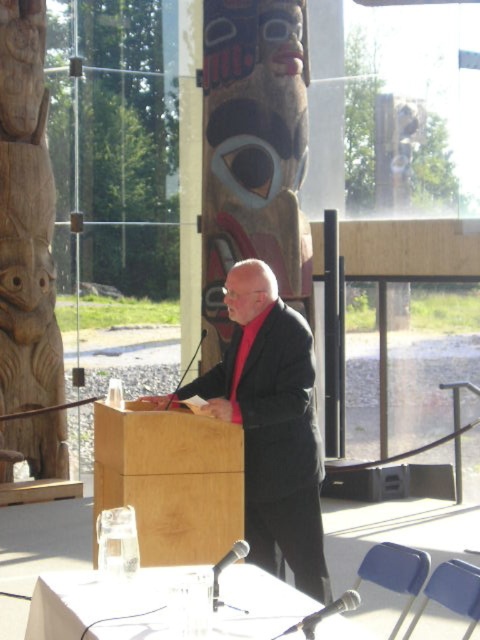
Can you confirm if dark gray suit at center is thinner than light wood podium at center?

Incorrect, dark gray suit at center's width is not less than light wood podium at center's.

Between dark gray suit at center and light wood podium at center, which one appears on the right side from the viewer's perspective?

From the viewer's perspective, dark gray suit at center appears more on the right side.

Does point (263, 385) come in front of point (224, 516)?

No.

Locate an element on the screen. This screenshot has width=480, height=640. dark gray suit at center is located at coordinates (271, 424).

Which of these two, wooden totem pole at left or light wood podium at center, stands taller?

wooden totem pole at left

Is wooden totem pole at left below light wood podium at center?

No.

Find the location of a particular element. The image size is (480, 640). wooden totem pole at left is located at coordinates (25, 216).

I want to click on wooden totem pole at left, so click(x=25, y=216).

Measure the distance between point [299,497] and camera.

Point [299,497] is 16.07 feet away from camera.

Describe the element at coordinates (271, 424) in the screenshot. I see `dark gray suit at center` at that location.

Between point (297, 532) and point (33, 150), which one is positioned in front?

Positioned in front is point (297, 532).

Locate an element on the screen. The width and height of the screenshot is (480, 640). dark gray suit at center is located at coordinates (271, 424).